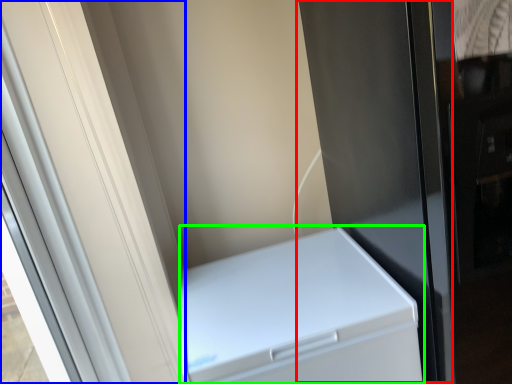
Question: Considering the real-world distances, which object is closest to screen door (highlighted by a red box)? screen door (highlighted by a blue box) or home appliance (highlighted by a green box).

Choices:
 (A) screen door
 (B) home appliance

Answer: (B)